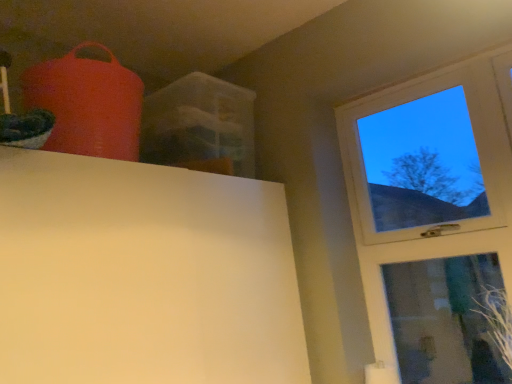
Question: From a real-world perspective, is green leafy plant at lower right positioned under transparent glass window at upper right based on gravity?

Choices:
 (A) no
 (B) yes

Answer: (B)

Question: Is green leafy plant at lower right surrounding transparent glass window at upper right?

Choices:
 (A) yes
 (B) no

Answer: (B)

Question: Is green leafy plant at lower right completely or partially outside of transparent glass window at upper right?

Choices:
 (A) yes
 (B) no

Answer: (A)

Question: Can you confirm if green leafy plant at lower right is positioned to the left of transparent glass window at upper right?

Choices:
 (A) yes
 (B) no

Answer: (B)

Question: Is green leafy plant at lower right not near transparent glass window at upper right?

Choices:
 (A) yes
 (B) no

Answer: (B)

Question: Is green leafy plant at lower right bigger than transparent glass window at upper right?

Choices:
 (A) no
 (B) yes

Answer: (A)

Question: Is transparent glass window at upper right facing away from green leafy plant at lower right?

Choices:
 (A) yes
 (B) no

Answer: (A)

Question: Would you say green leafy plant at lower right is part of transparent glass window at upper right's contents?

Choices:
 (A) no
 (B) yes

Answer: (A)

Question: From the image's perspective, is transparent glass window at upper right over green leafy plant at lower right?

Choices:
 (A) yes
 (B) no

Answer: (A)

Question: Are transparent glass window at upper right and green leafy plant at lower right far apart?

Choices:
 (A) no
 (B) yes

Answer: (A)

Question: Does transparent glass window at upper right turn towards green leafy plant at lower right?

Choices:
 (A) yes
 (B) no

Answer: (A)

Question: Considering the relative sizes of transparent glass window at upper right and green leafy plant at lower right in the image provided, is transparent glass window at upper right shorter than green leafy plant at lower right?

Choices:
 (A) no
 (B) yes

Answer: (A)

Question: Is transparent glass window at upper right spatially inside green leafy plant at lower right, or outside of it?

Choices:
 (A) inside
 (B) outside

Answer: (B)